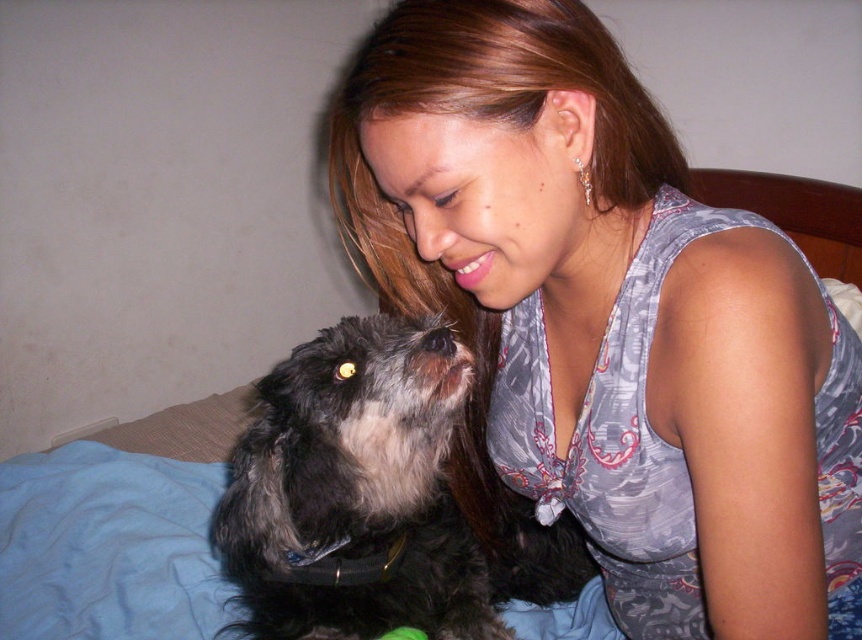
You are an interior designer assessing the layout of this room. You notice the gray fabric at upper center and the fuzzy black dog at center. Which object has a smaller width?

The gray fabric at upper center has a lesser width compared to the fuzzy black dog at center.

You are a photographer trying to capture the interaction between the woman and her dog. You notice the gray fabric at upper center and the fuzzy black dog at center. Which object is positioned closer to the camera?

The gray fabric at upper center is closer to the viewer than the fuzzy black dog at center, so it would appear closer to the camera.

You are standing 20 inches away from the point at coordinates point (498, 4). Can you reach it without moving closer?

Result: The distance of point (498, 4) from viewer is 23.63 inches, so you are currently 20 inches away from it. Since 20 inches is less than 23.63 inches, you are actually closer than the stated distance. Therefore, you can reach it without moving closer.